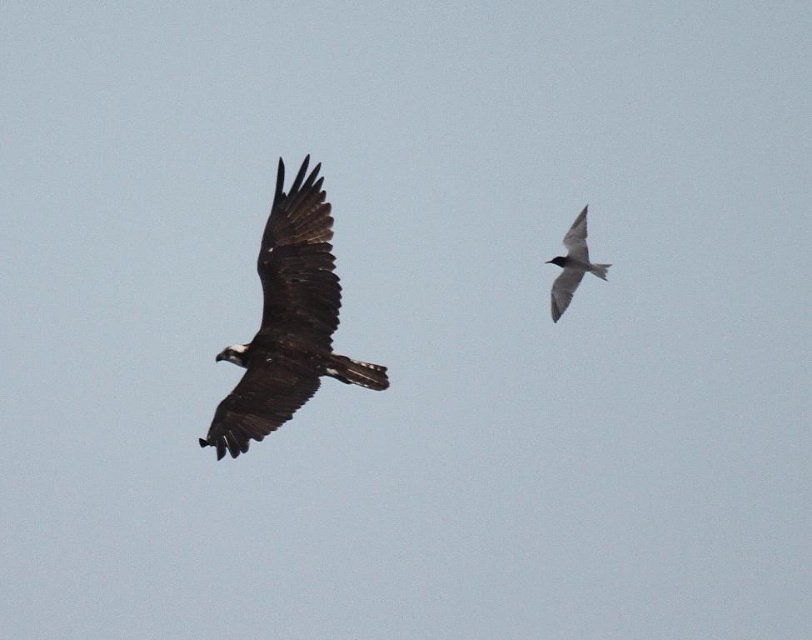
Is dark brown feathers at left thinner than gray matte bird at upper right?

Incorrect, dark brown feathers at left's width is not less than gray matte bird at upper right's.

Where is `dark brown feathers at left`? The height and width of the screenshot is (640, 812). dark brown feathers at left is located at coordinates (288, 321).